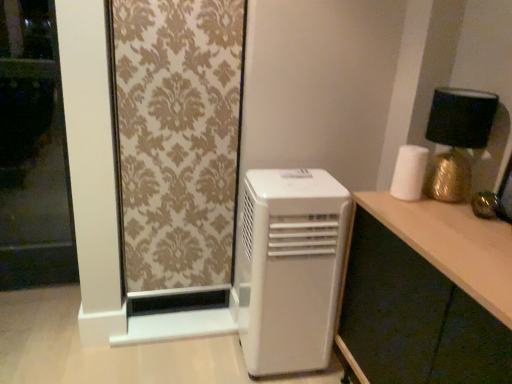
Question: From the image's perspective, is white matte paper towel at right under gold metallic table lamp at upper right?

Choices:
 (A) yes
 (B) no

Answer: (A)

Question: From a real-world perspective, is white matte paper towel at right positioned under gold metallic table lamp at upper right based on gravity?

Choices:
 (A) no
 (B) yes

Answer: (B)

Question: Is white matte paper towel at right smaller than gold metallic table lamp at upper right?

Choices:
 (A) yes
 (B) no

Answer: (A)

Question: Is gold metallic table lamp at upper right a part of white matte paper towel at right?

Choices:
 (A) yes
 (B) no

Answer: (B)

Question: Is white matte paper towel at right facing towards gold metallic table lamp at upper right?

Choices:
 (A) no
 (B) yes

Answer: (A)

Question: Is point (347, 266) closer or farther from the camera than point (412, 198)?

Choices:
 (A) farther
 (B) closer

Answer: (A)

Question: Is wooden desk at right inside the boundaries of white matte paper towel at right, or outside?

Choices:
 (A) outside
 (B) inside

Answer: (A)

Question: Is wooden desk at right taller or shorter than white matte paper towel at right?

Choices:
 (A) short
 (B) tall

Answer: (B)

Question: From the image's perspective, is wooden desk at right above or below white matte paper towel at right?

Choices:
 (A) above
 (B) below

Answer: (B)

Question: Is point (443, 134) positioned closer to the camera than point (66, 223)?

Choices:
 (A) closer
 (B) farther

Answer: (A)

Question: From a real-world perspective, is gold metallic table lamp at upper right physically located above or below transparent glass screen door at left?

Choices:
 (A) below
 (B) above

Answer: (B)

Question: Is gold metallic table lamp at upper right taller or shorter than transparent glass screen door at left?

Choices:
 (A) tall
 (B) short

Answer: (B)

Question: From the image's perspective, is gold metallic table lamp at upper right above or below transparent glass screen door at left?

Choices:
 (A) below
 (B) above

Answer: (B)

Question: Would you say white plastic air conditioner at lower center is to the left or to the right of wooden desk at right in the picture?

Choices:
 (A) right
 (B) left

Answer: (B)

Question: Is white plastic air conditioner at lower center bigger or smaller than wooden desk at right?

Choices:
 (A) big
 (B) small

Answer: (B)